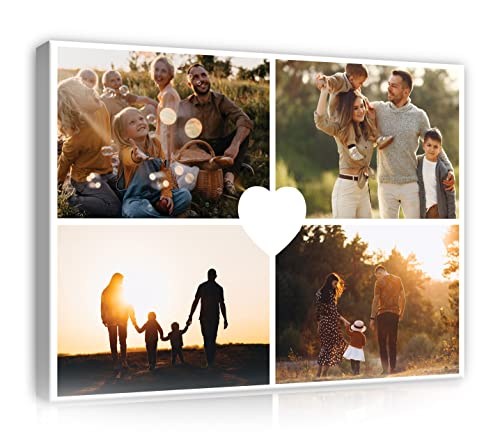
The image size is (500, 448). Find the location of `picture boxes`. picture boxes is located at coordinates pos(382,319), pos(411,159), pos(116,136), pos(134,326).